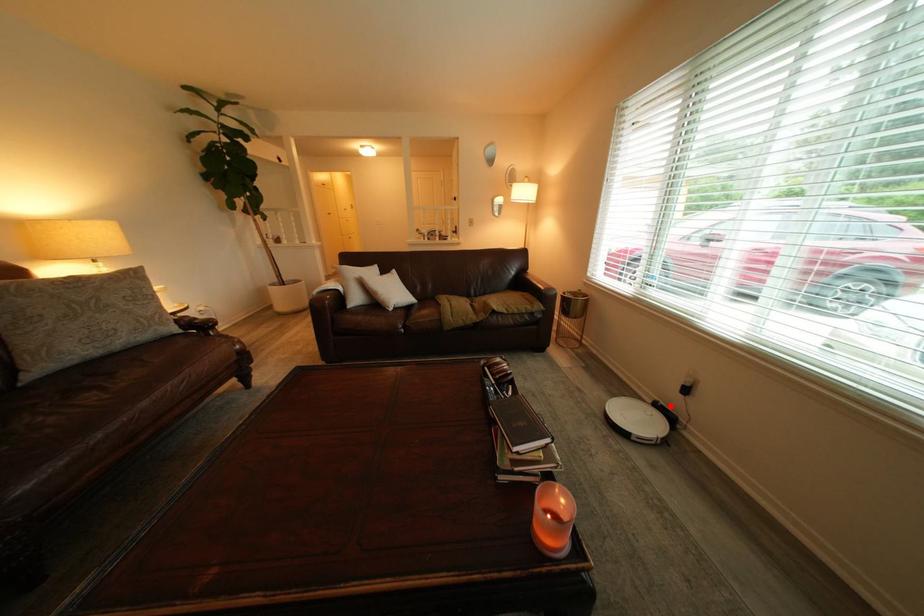
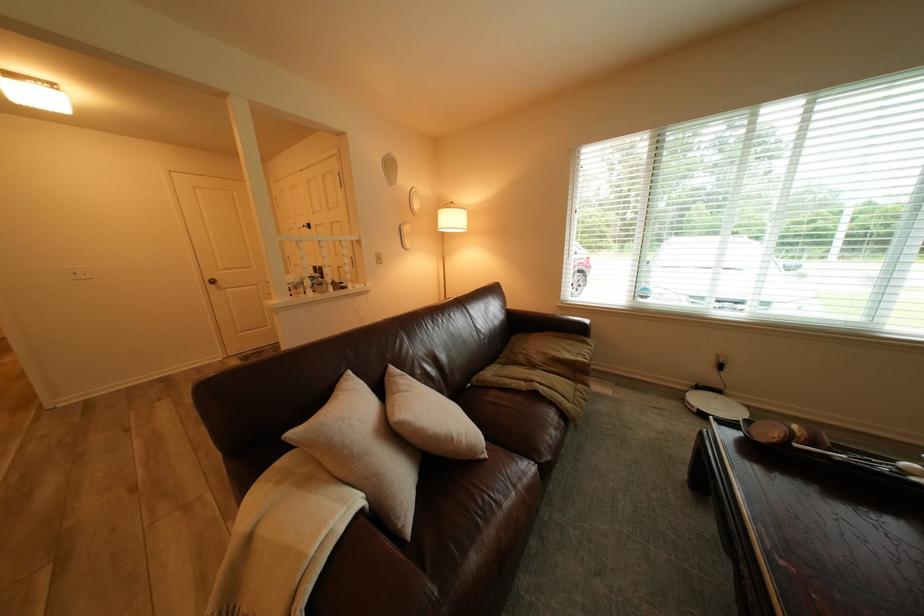
Find the pixel in the second image that matches the highlighted location in the first image.

(712, 389)